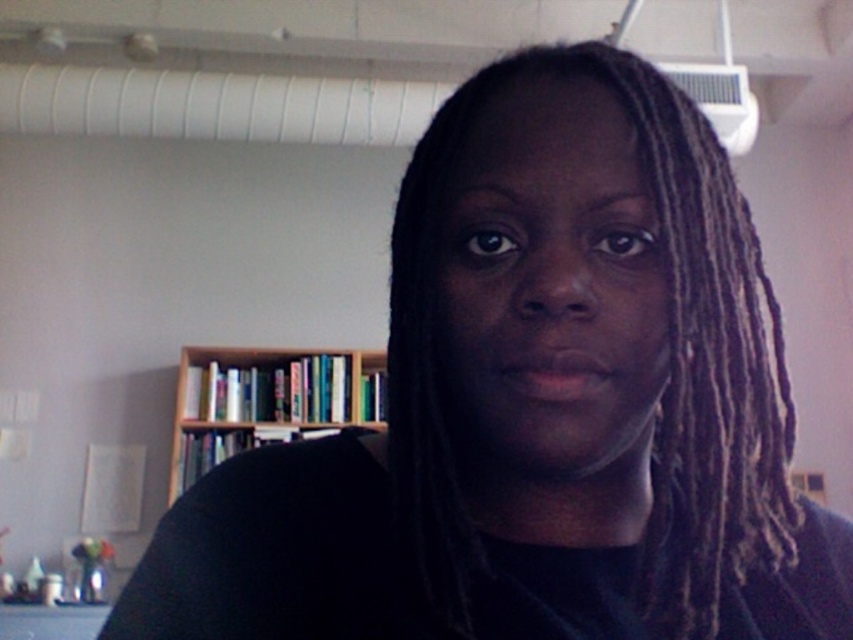
Question: Does brown/dry/dreadlocks at center come in front of wooden bookshelf at center?

Choices:
 (A) no
 (B) yes

Answer: (B)

Question: Which of the following is the farthest from the observer?

Choices:
 (A) wooden bookshelf at center
 (B) brown/dry/dreadlocks at center

Answer: (A)

Question: Does brown/dry/dreadlocks at center appear over wooden bookshelf at center?

Choices:
 (A) yes
 (B) no

Answer: (A)

Question: Can you confirm if brown/dry/dreadlocks at center is wider than wooden bookshelf at center?

Choices:
 (A) yes
 (B) no

Answer: (B)

Question: Which object is closer to the camera taking this photo?

Choices:
 (A) brown/dry/dreadlocks at center
 (B) wooden bookshelf at center

Answer: (A)